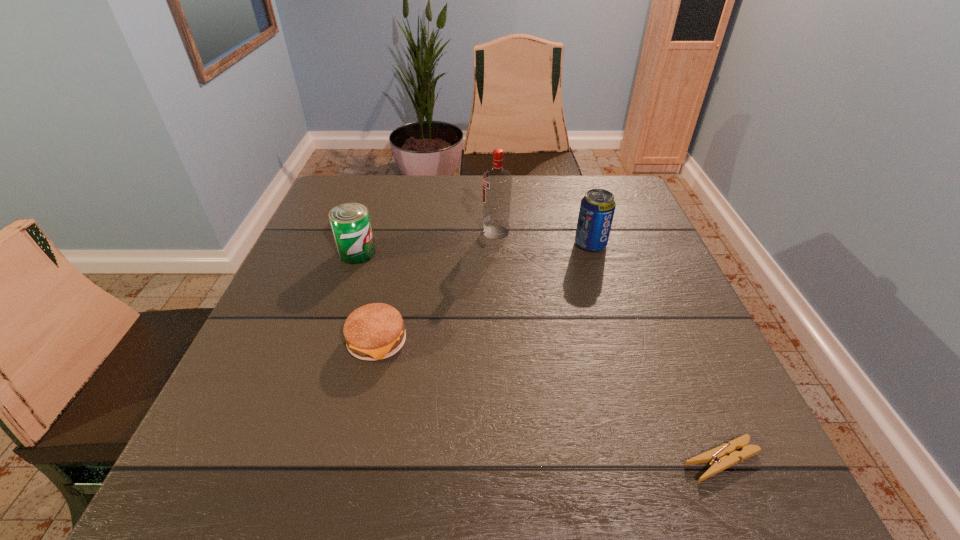
At what (x,y) coordinates should I click in order to perform the action: click on vacant space that's between the shortest object and the second nearest object. Please return your answer as a coordinate pair (x, y). The height and width of the screenshot is (540, 960). Looking at the image, I should click on (549, 401).

You are a GUI agent. You are given a task and a screenshot of the screen. Output one action in this format:
    pyautogui.click(x=<x>, y=<y>)
    Task: Click on the free area in between the nearest object and the second nearest object
    The height and width of the screenshot is (540, 960).
    Given the screenshot: What is the action you would take?
    pyautogui.click(x=549, y=401)

At what (x,y) coordinates should I click in order to perform the action: click on free spot between the soda and the tallest object. Please return your answer as a coordinate pair (x, y). Looking at the image, I should click on (543, 238).

Find the location of a particular element. free space between the clothespin and the fourth shortest object is located at coordinates (656, 353).

Where is `vacant space that's between the soda and the shortest object`? The width and height of the screenshot is (960, 540). vacant space that's between the soda and the shortest object is located at coordinates (656, 353).

Image resolution: width=960 pixels, height=540 pixels. In order to click on free space between the hamburger and the soda in this screenshot , I will do `click(484, 293)`.

Where is `blank region between the vodka and the third tallest object`? The height and width of the screenshot is (540, 960). blank region between the vodka and the third tallest object is located at coordinates (426, 242).

This screenshot has width=960, height=540. In order to click on the closest object to the third shortest object in this screenshot , I will do `click(376, 331)`.

Locate an element on the screen. This screenshot has width=960, height=540. the fourth closest object to the clothespin is located at coordinates (350, 222).

This screenshot has height=540, width=960. What are the coordinates of `vacant space that satisfies the following two spatial constraints: 1. on the back side of the can; 2. on the right side of the soda` in the screenshot? It's located at (360, 245).